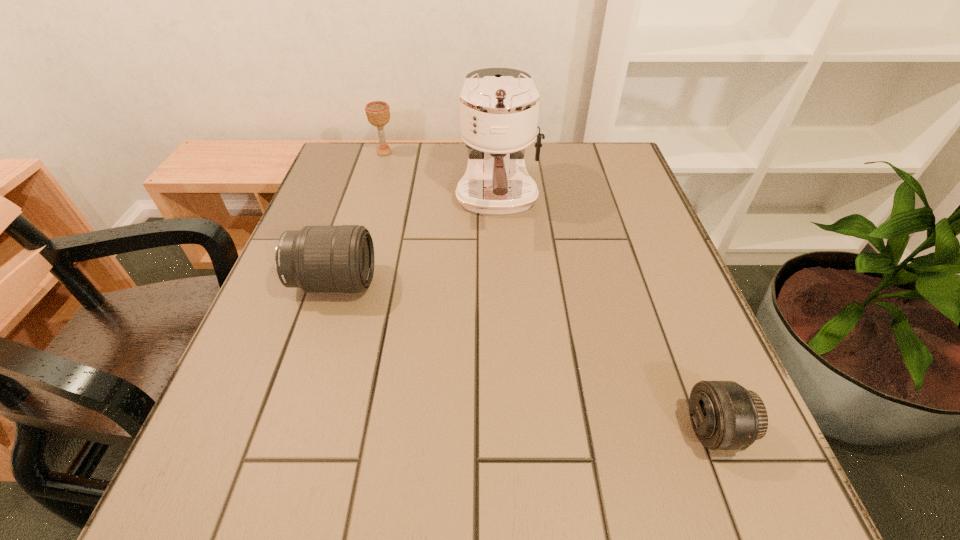
Image resolution: width=960 pixels, height=540 pixels. In order to click on the third nearest object in this screenshot , I will do `click(499, 107)`.

Find the location of a particular element. the tallest object is located at coordinates (499, 107).

Where is `the farthest object`? This screenshot has width=960, height=540. the farthest object is located at coordinates (378, 112).

Image resolution: width=960 pixels, height=540 pixels. What are the coordinates of `the farther telephoto lens` in the screenshot? It's located at (316, 258).

Locate an element on the screen. The image size is (960, 540). the taller telephoto lens is located at coordinates (316, 258).

Identify the location of the rightmost object. (724, 415).

Identify the location of the nearest object. This screenshot has height=540, width=960. (724, 415).

In order to click on vacant space located on the front-facing side of the coffee maker in this screenshot , I will do `click(501, 281)`.

Identify the location of vacant area located on the front of the farthest object. The image size is (960, 540). (363, 224).

Identify the location of free spot located 0.310m on the surface of the taller telephoto lens. This screenshot has height=540, width=960. (525, 283).